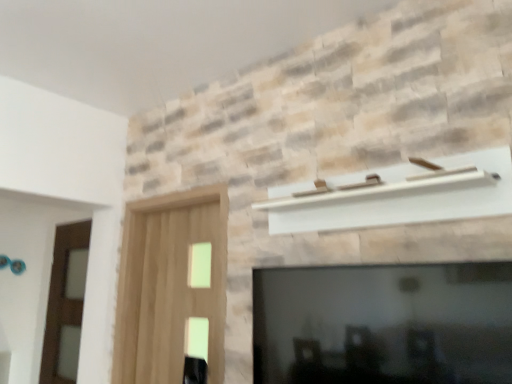
What do you see at coordinates (169, 284) in the screenshot? I see `light brown wood screen door at left, which is counted as the first screen door, starting from the front` at bounding box center [169, 284].

Identify the location of black glass fireplace at lower center. The image size is (512, 384). (383, 324).

The width and height of the screenshot is (512, 384). What do you see at coordinates (65, 304) in the screenshot?
I see `brown wooden screen door at left, which is the 1th screen door in back-to-front order` at bounding box center [65, 304].

Where is `light brown wood screen door at left, marked as the 1th screen door in a right-to-left arrangement`? light brown wood screen door at left, marked as the 1th screen door in a right-to-left arrangement is located at coordinates (169, 284).

Is brown wooden screen door at left, which is the 1th screen door in back-to-front order, aimed at black glass fireplace at lower center?

No, brown wooden screen door at left, which is the 1th screen door in back-to-front order, is not oriented towards black glass fireplace at lower center.

From the image's perspective, relative to black glass fireplace at lower center, is brown wooden screen door at left, which is the 1th screen door in back-to-front order, above or below?

Based on their image positions, brown wooden screen door at left, which is the 1th screen door in back-to-front order, is located beneath black glass fireplace at lower center.

Could black glass fireplace at lower center be considered to be inside brown wooden screen door at left, which is the first screen door in left-to-right order?

That's incorrect, black glass fireplace at lower center is not inside brown wooden screen door at left, which is the first screen door in left-to-right order.

Locate an element on the screen. Image resolution: width=512 pixels, height=384 pixels. fireplace that is in front of the brown wooden screen door at left, which is the first screen door in left-to-right order is located at coordinates (383, 324).

Consider the image. From a real-world perspective, is black glass fireplace at lower center on brown wooden screen door at left, which is the 2th screen door from front to back?

No.

From the image's perspective, which is below, black glass fireplace at lower center or brown wooden screen door at left, which is the 1th screen door in back-to-front order?

From the image's view, brown wooden screen door at left, which is the 1th screen door in back-to-front order, is below.

Is black glass fireplace at lower center not close to brown wooden screen door at left, which is the 2th screen door from front to back?

That's right, there is a large distance between black glass fireplace at lower center and brown wooden screen door at left, which is the 2th screen door from front to back.

Based on the photo, is brown wooden screen door at left, which is the 2th screen door from front to back, turned away from light brown wood screen door at left, which appears as the second screen door when viewed from the back?

No, brown wooden screen door at left, which is the 2th screen door from front to back, is not facing the opposite direction of light brown wood screen door at left, which appears as the second screen door when viewed from the back.

In the scene shown: From a real-world perspective, is brown wooden screen door at left, the second screen door viewed from the right, on light brown wood screen door at left, which is the 2th screen door from left to right?

No, from a real-world perspective, brown wooden screen door at left, the second screen door viewed from the right, is not above light brown wood screen door at left, which is the 2th screen door from left to right.

Is brown wooden screen door at left, which is the 1th screen door in back-to-front order, next to light brown wood screen door at left, which appears as the second screen door when viewed from the back, and touching it?

They are not placed beside each other.

You are a GUI agent. You are given a task and a screenshot of the screen. Output one action in this format:
    pyautogui.click(x=<x>, y=<y>)
    Task: Click on the screen door on the left of light brown wood screen door at left, marked as the 1th screen door in a right-to-left arrangement
    
    Given the screenshot: What is the action you would take?
    pyautogui.click(x=65, y=304)

Is light brown wood screen door at left, marked as the 1th screen door in a right-to-left arrangement, inside or outside of brown wooden screen door at left, which is the 1th screen door in back-to-front order?

light brown wood screen door at left, marked as the 1th screen door in a right-to-left arrangement, is located beyond the bounds of brown wooden screen door at left, which is the 1th screen door in back-to-front order.

Which of these two, light brown wood screen door at left, which is counted as the first screen door, starting from the front, or brown wooden screen door at left, which is the 1th screen door in back-to-front order, is smaller?

brown wooden screen door at left, which is the 1th screen door in back-to-front order, is smaller.

Is light brown wood screen door at left, which appears as the second screen door when viewed from the back, further to camera compared to brown wooden screen door at left, which is the first screen door in left-to-right order?

No, the depth of light brown wood screen door at left, which appears as the second screen door when viewed from the back, is less than that of brown wooden screen door at left, which is the first screen door in left-to-right order.

From the image's perspective, relative to brown wooden screen door at left, which is the 2th screen door from front to back, is light brown wood screen door at left, marked as the 1th screen door in a right-to-left arrangement, above or below?

light brown wood screen door at left, marked as the 1th screen door in a right-to-left arrangement, is situated higher than brown wooden screen door at left, which is the 2th screen door from front to back, in the image.

Is light brown wood screen door at left, which appears as the second screen door when viewed from the back, facing away from black glass fireplace at lower center?

No.

From the image's perspective, starting from the black glass fireplace at lower center, which screen door is the 1st one below? Please provide its 2D coordinates.

[(169, 284)]

Is point (157, 289) in front of point (325, 331)?

No.

How far apart are light brown wood screen door at left, which is the 2th screen door from left to right, and black glass fireplace at lower center?

light brown wood screen door at left, which is the 2th screen door from left to right, is 35.91 inches away from black glass fireplace at lower center.

Looking at this image, between black glass fireplace at lower center and light brown wood screen door at left, which appears as the second screen door when viewed from the back, which one appears on the left side from the viewer's perspective?

light brown wood screen door at left, which appears as the second screen door when viewed from the back, is more to the left.

Can you tell me how much black glass fireplace at lower center and light brown wood screen door at left, marked as the 1th screen door in a right-to-left arrangement, differ in facing direction?

black glass fireplace at lower center and light brown wood screen door at left, marked as the 1th screen door in a right-to-left arrangement, are facing 0.000463 degrees away from each other.

In order to click on fireplace above the light brown wood screen door at left, which appears as the second screen door when viewed from the back (from the image's perspective) in this screenshot , I will do `click(383, 324)`.

From a real-world perspective, is black glass fireplace at lower center beneath light brown wood screen door at left, which appears as the second screen door when viewed from the back?

Yes, from a real-world perspective, black glass fireplace at lower center is under light brown wood screen door at left, which appears as the second screen door when viewed from the back.

I want to click on fireplace that appears on the right of brown wooden screen door at left, which is the first screen door in left-to-right order, so click(x=383, y=324).

Find the location of a particular element. This screenshot has width=512, height=384. screen door that is the 2nd object located behind the black glass fireplace at lower center is located at coordinates (65, 304).

Which object lies nearer to the anchor point light brown wood screen door at left, which is counted as the first screen door, starting from the front, brown wooden screen door at left, the second screen door viewed from the right, or black glass fireplace at lower center?

Based on the image, black glass fireplace at lower center appears to be nearer to light brown wood screen door at left, which is counted as the first screen door, starting from the front.

Looking at the image, which one is located further to black glass fireplace at lower center, light brown wood screen door at left, marked as the 1th screen door in a right-to-left arrangement, or brown wooden screen door at left, which is the 1th screen door in back-to-front order?

brown wooden screen door at left, which is the 1th screen door in back-to-front order, is further to black glass fireplace at lower center.

Estimate the real-world distances between objects in this image. Which object is further from black glass fireplace at lower center, brown wooden screen door at left, which is the first screen door in left-to-right order, or light brown wood screen door at left, which is counted as the first screen door, starting from the front?

The object further to black glass fireplace at lower center is brown wooden screen door at left, which is the first screen door in left-to-right order.

Considering their positions, is black glass fireplace at lower center positioned further to light brown wood screen door at left, which appears as the second screen door when viewed from the back, than brown wooden screen door at left, which is the 1th screen door in back-to-front order?

brown wooden screen door at left, which is the 1th screen door in back-to-front order.

Estimate the real-world distances between objects in this image. Which object is further from brown wooden screen door at left, the second screen door viewed from the right, black glass fireplace at lower center or light brown wood screen door at left, marked as the 1th screen door in a right-to-left arrangement?

black glass fireplace at lower center is further to brown wooden screen door at left, the second screen door viewed from the right.

When comparing their distances from brown wooden screen door at left, which is the 1th screen door in back-to-front order, does light brown wood screen door at left, which is counted as the first screen door, starting from the front, or black glass fireplace at lower center seem further?

Among the two, black glass fireplace at lower center is located further to brown wooden screen door at left, which is the 1th screen door in back-to-front order.

I want to click on screen door located between brown wooden screen door at left, which is the first screen door in left-to-right order, and black glass fireplace at lower center in the left-right direction, so click(169, 284).